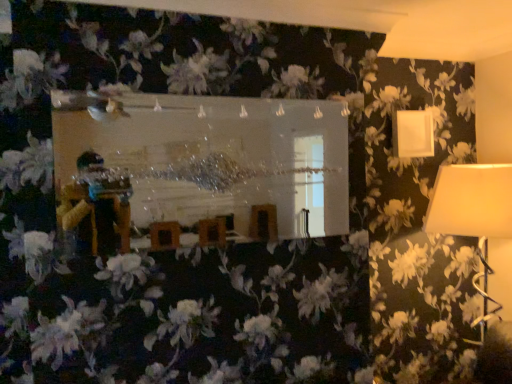
I want to click on free space above clear glass mirror at center (from a real-world perspective), so click(226, 91).